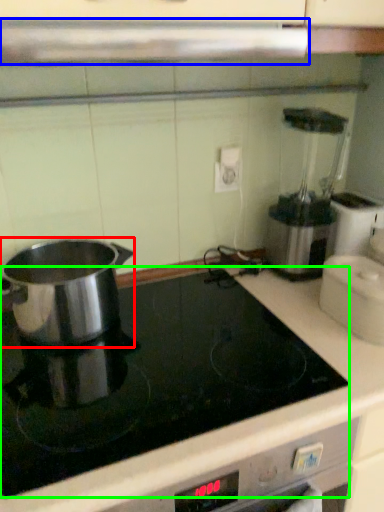
Question: Which object is positioned farthest from kitchen appliance (highlighted by a red box)? Select from exhaust hood (highlighted by a blue box) and kitchen appliance (highlighted by a green box).

Choices:
 (A) exhaust hood
 (B) kitchen appliance

Answer: (A)